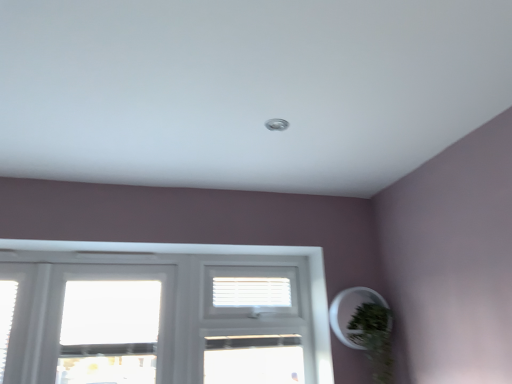
Question: From the image's perspective, is white plastic blinds at center on green matte plant at lower right?

Choices:
 (A) no
 (B) yes

Answer: (B)

Question: Does white plastic blinds at center have a greater width compared to green matte plant at lower right?

Choices:
 (A) yes
 (B) no

Answer: (B)

Question: Are white plastic blinds at center and green matte plant at lower right making contact?

Choices:
 (A) yes
 (B) no

Answer: (B)

Question: Does white plastic blinds at center have a lesser width compared to green matte plant at lower right?

Choices:
 (A) no
 (B) yes

Answer: (B)

Question: Is the depth of white plastic blinds at center greater than that of green matte plant at lower right?

Choices:
 (A) yes
 (B) no

Answer: (A)

Question: In terms of width, does green matte plant at lower right look wider or thinner when compared to white plastic blinds at center?

Choices:
 (A) wide
 (B) thin

Answer: (A)

Question: Does point (367, 321) appear closer or farther from the camera than point (242, 284)?

Choices:
 (A) farther
 (B) closer

Answer: (B)

Question: Is green matte plant at lower right situated inside white plastic blinds at center or outside?

Choices:
 (A) outside
 (B) inside

Answer: (A)

Question: From the image's perspective, is green matte plant at lower right positioned above or below white plastic blinds at center?

Choices:
 (A) above
 (B) below

Answer: (B)

Question: From a real-world perspective, relative to green matte plant at lower right, is white plastic screen door at center vertically above or below?

Choices:
 (A) below
 (B) above

Answer: (B)

Question: Choose the correct answer: Is white plastic screen door at center inside green matte plant at lower right or outside it?

Choices:
 (A) outside
 (B) inside

Answer: (A)

Question: Considering their positions, is white plastic screen door at center located in front of or behind green matte plant at lower right?

Choices:
 (A) behind
 (B) front

Answer: (A)

Question: Is white plastic screen door at center wider or thinner than green matte plant at lower right?

Choices:
 (A) wide
 (B) thin

Answer: (B)

Question: Is white plastic blinds at center spatially inside green matte plant at lower right, or outside of it?

Choices:
 (A) outside
 (B) inside

Answer: (A)

Question: From the image's perspective, relative to green matte plant at lower right, is white plastic blinds at center above or below?

Choices:
 (A) below
 (B) above

Answer: (B)